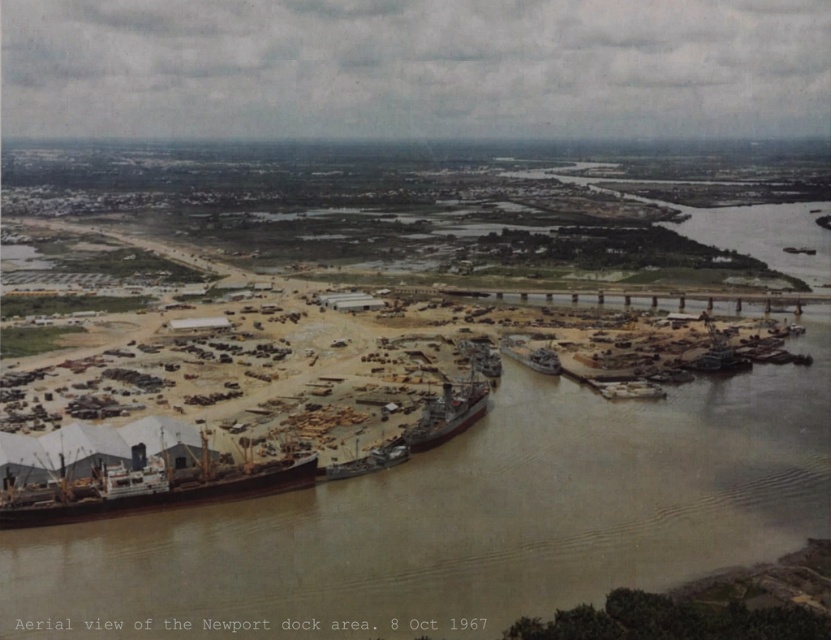
Who is more distant from viewer, [445,440] or [543,346]?

Positioned behind is point [543,346].

Is dark gray metallic ship at center closer to camera compared to rustic wooden boat at lower right?

Yes, dark gray metallic ship at center is in front of rustic wooden boat at lower right.

You are a GUI agent. You are given a task and a screenshot of the screen. Output one action in this format:
    pyautogui.click(x=<x>, y=<y>)
    Task: Click on the dark gray metallic ship at center
    The image size is (831, 640).
    Given the screenshot: What is the action you would take?
    pyautogui.click(x=448, y=412)

Identify the location of dark gray metallic ship at center. (448, 412).

Between point (426, 436) and point (620, 392), which one is positioned behind?

Positioned behind is point (620, 392).

Measure the distance between dark gray metallic ship at center and camera.

dark gray metallic ship at center and camera are 527.83 meters apart.

This screenshot has height=640, width=831. I want to click on dark gray metallic ship at center, so click(448, 412).

Is brown wooden ship at center wider than rustic wooden boat at lower right?

Yes, brown wooden ship at center is wider than rustic wooden boat at lower right.

Is point (397, 445) in front of point (529, 349)?

Yes, it is in front of point (529, 349).

Find the location of `brown wooden ship at center`. brown wooden ship at center is located at coordinates (367, 461).